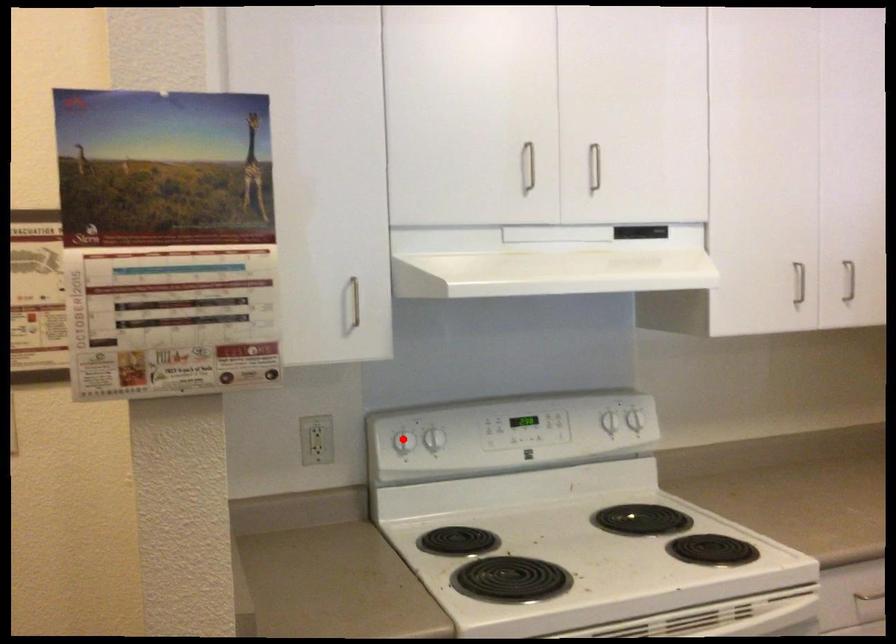
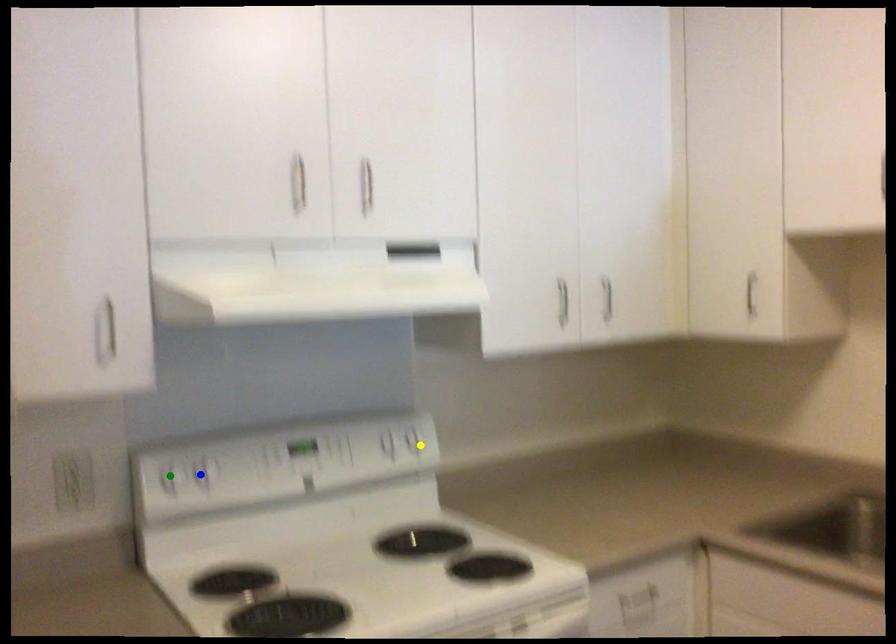
Question: I am providing you with two images of the same scene from different viewpoints. A red point is marked on the first image. You are given multiple points on the second image. In image 2, which mark is for the same physical point as the one in image 1?

Choices:
 (A) green point
 (B) yellow point
 (C) blue point

Answer: (A)